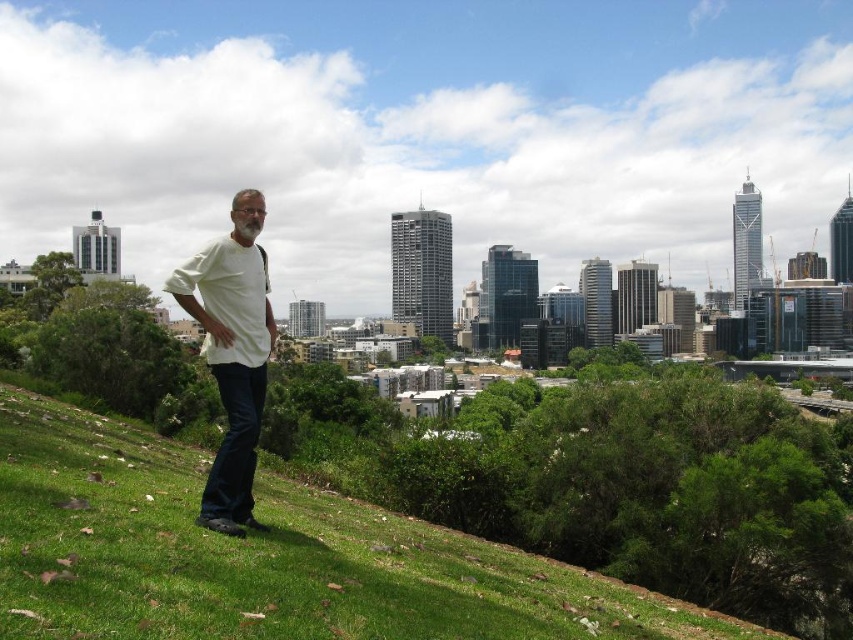
Does green grass at lower left have a larger size compared to white matte shirt at center?

Correct, green grass at lower left is larger in size than white matte shirt at center.

Is point (256, 589) more distant than point (213, 333)?

No.

Is point (534, 595) less distant than point (247, 465)?

Yes.

In order to click on green grass at lower left in this screenshot , I will do `click(267, 556)`.